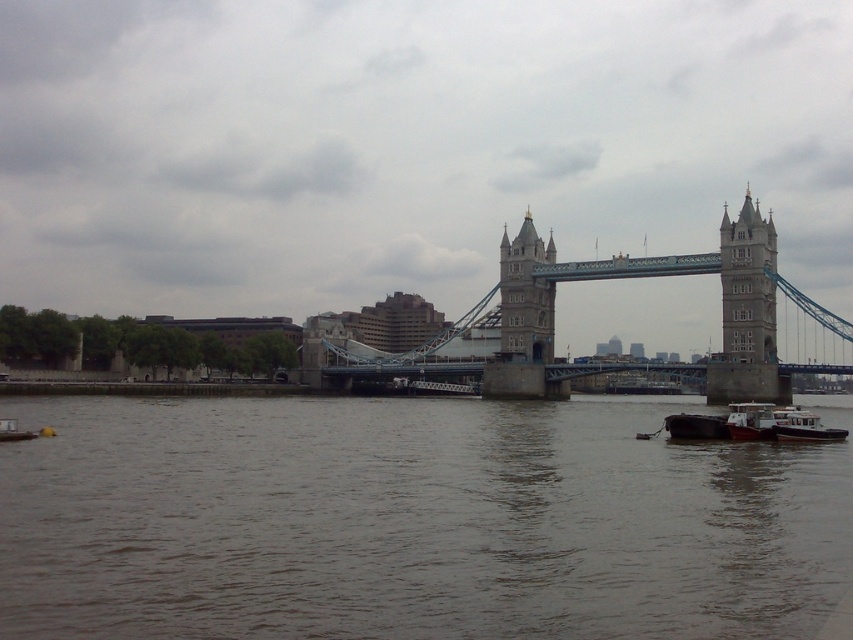
You are a tour guide explaining the distance between the brown water at lower center and the stone tower at center to a tourist. What would you say?

The brown water at lower center is 120.32 feet away from the stone tower at center.

You are a photographer planning to capture the Tower Bridge with both the stone stonework tower at center and the white matte barge at lower right in the same frame. Given their sizes, which object should you position closer to the camera to ensure both fit in the photo?

Since the stone stonework tower at center is narrower than the white matte barge at lower right, you should position the stone stonework tower at center closer to the camera to ensure both fit in the photo.

You are standing on the walkway of the Tower Bridge and notice the brown water at lower center and the stone tower at center. Which object is positioned to the right side of the other?

The stone tower at center is positioned to the right of the brown water at lower center because the brown water at lower center is to the left of stone tower at center.